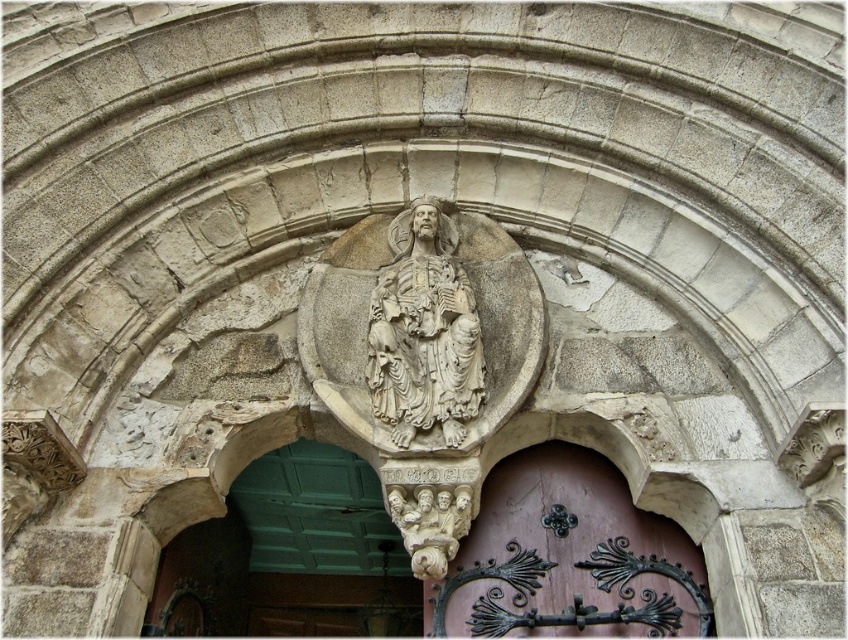
Is the position of pink wood door at center less distant than that of white stone carving at center?

No, it is behind white stone carving at center.

Can you confirm if pink wood door at center is positioned below white stone carving at center?

Yes, pink wood door at center is below white stone carving at center.

Is point (589, 480) more distant than point (420, 532)?

Yes, point (589, 480) is behind point (420, 532).

At what (x,y) coordinates should I click in order to perform the action: click on pink wood door at center. Please return your answer as a coordinate pair (x, y). The image size is (848, 640). Looking at the image, I should click on (568, 557).

Can you confirm if white stone statue at center is shorter than white stone carving at center?

No, white stone statue at center is not shorter than white stone carving at center.

Does white stone statue at center have a greater width compared to white stone carving at center?

Correct, the width of white stone statue at center exceeds that of white stone carving at center.

Which is in front, point (467, 365) or point (411, 541)?

Point (411, 541)

Where is `white stone statue at center`? white stone statue at center is located at coordinates (424, 332).

From the picture: Who is positioned more to the right, pink wood door at center or white stone statue at center?

Positioned to the right is pink wood door at center.

Measure the distance between point (522,465) and camera.

Point (522,465) is 56.32 meters from camera.

Does point (593, 500) come closer to viewer compared to point (372, 349)?

No, (593, 500) is behind (372, 349).

Identify the location of pink wood door at center. (568, 557).